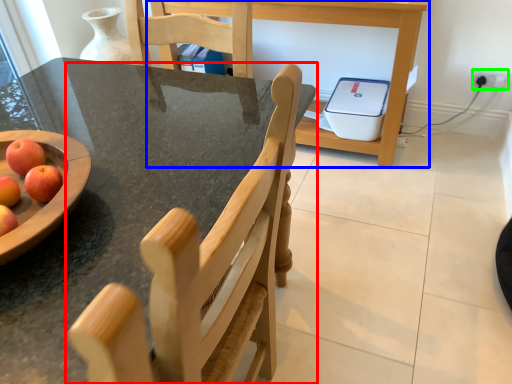
Question: Based on their relative distances, which object is nearer to chair (highlighted by a red box)? Choose from table (highlighted by a blue box) and electric outlet (highlighted by a green box).

Choices:
 (A) table
 (B) electric outlet

Answer: (A)